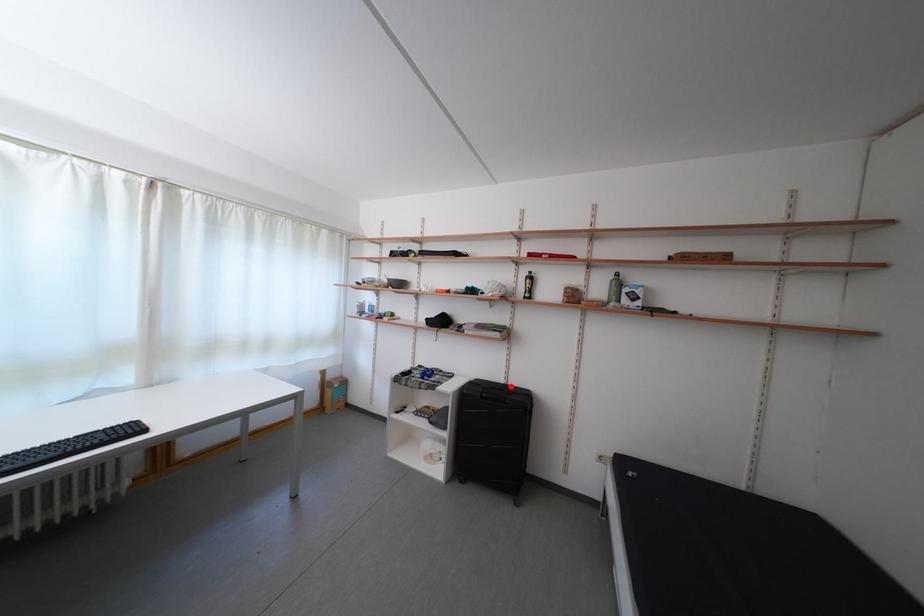
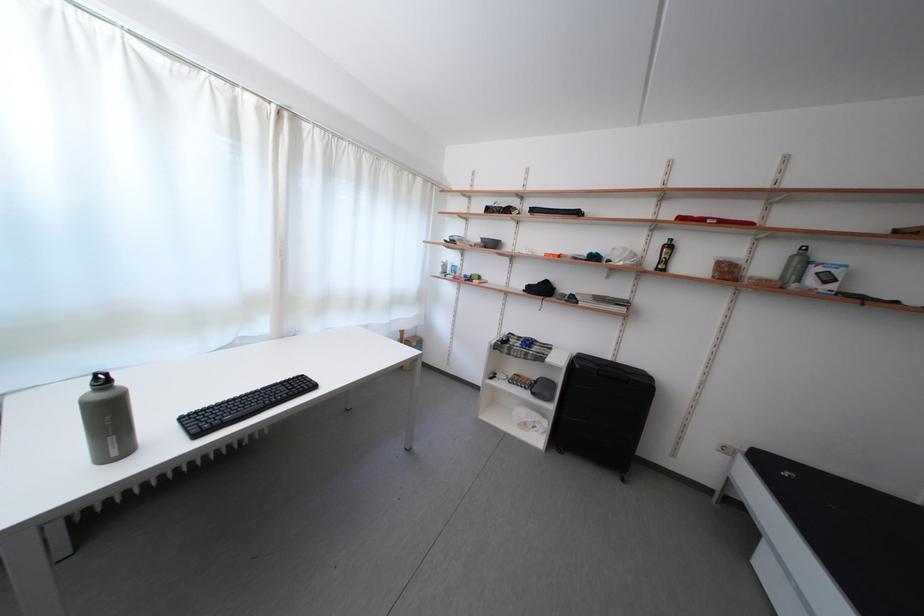
Locate, in the second image, the point that corresponds to the highlighted location in the first image.

(617, 363)